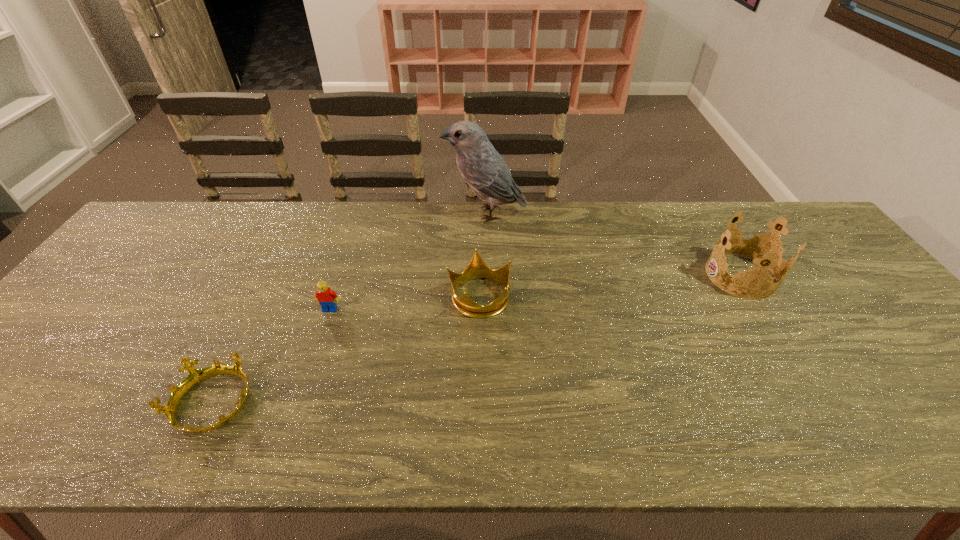
Where is `vacant region between the shortest object and the second crown from right to left`? The height and width of the screenshot is (540, 960). vacant region between the shortest object and the second crown from right to left is located at coordinates (347, 349).

This screenshot has width=960, height=540. What are the coordinates of `free space between the fourth shortest object and the second object from left to right` in the screenshot? It's located at (536, 292).

Image resolution: width=960 pixels, height=540 pixels. Find the location of `vacant space that is in between the second tallest crown and the nearest object`. vacant space that is in between the second tallest crown and the nearest object is located at coordinates (347, 349).

Locate an element on the screen. Image resolution: width=960 pixels, height=540 pixels. free space between the nearest object and the tallest crown is located at coordinates (477, 340).

Where is `vacant area that lies between the leftmost object and the fourth shortest object`? vacant area that lies between the leftmost object and the fourth shortest object is located at coordinates (477, 340).

The image size is (960, 540). I want to click on empty space that is in between the Lego and the tallest crown, so click(536, 292).

At what (x,y) coordinates should I click in order to perform the action: click on free space between the Lego and the second shortest crown. Please return your answer as a coordinate pair (x, y). The image size is (960, 540). Looking at the image, I should click on (404, 302).

Find the location of `free space between the farthest object and the second shortest crown`. free space between the farthest object and the second shortest crown is located at coordinates (482, 255).

Identify the location of vacant space that is in between the second tallest object and the second tallest crown. (610, 286).

Find the location of a particular element. The height and width of the screenshot is (540, 960). free space between the tallest crown and the nearest object is located at coordinates (477, 340).